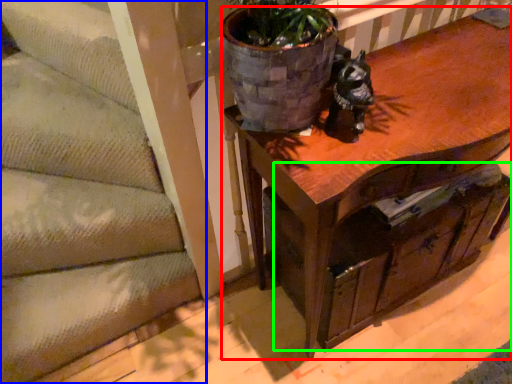
Question: Estimate the real-world distances between objects in this image. Which object is farther from table (highlighted by a red box), stairwell (highlighted by a blue box) or drawer (highlighted by a green box)?

Choices:
 (A) stairwell
 (B) drawer

Answer: (A)